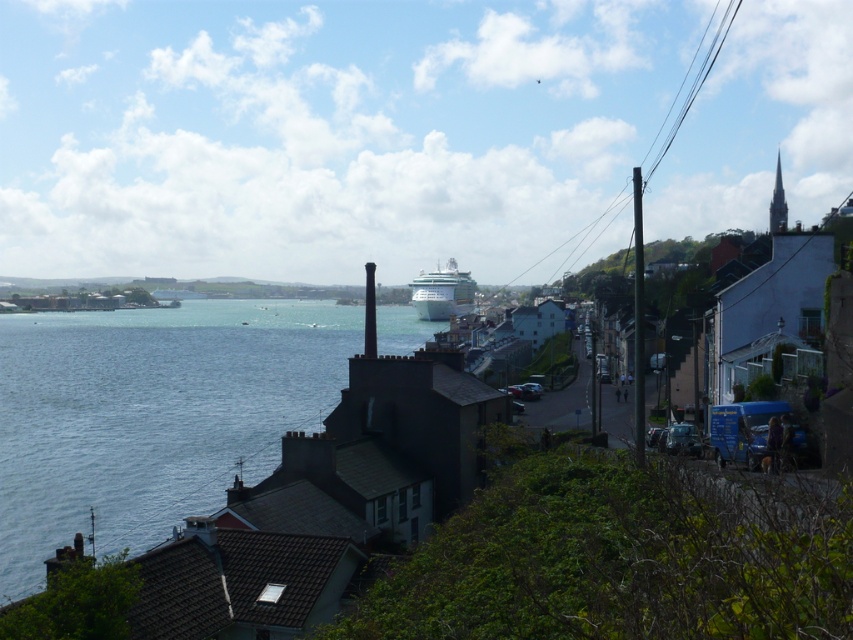
Question: Among these points, which one is nearest to the camera?

Choices:
 (A) (454, 304)
 (B) (258, 481)

Answer: (B)

Question: Is blue water at lower left thinner than white glossy cruise ship at center?

Choices:
 (A) no
 (B) yes

Answer: (A)

Question: Which of the following is the farthest from the observer?

Choices:
 (A) white glossy cruise ship at center
 (B) blue water at lower left

Answer: (A)

Question: Which point is farther to the camera?

Choices:
 (A) (201, 403)
 (B) (471, 282)

Answer: (B)

Question: Can you confirm if blue water at lower left is thinner than white glossy cruise ship at center?

Choices:
 (A) no
 (B) yes

Answer: (A)

Question: Can you confirm if blue water at lower left is positioned below white glossy cruise ship at center?

Choices:
 (A) no
 (B) yes

Answer: (B)